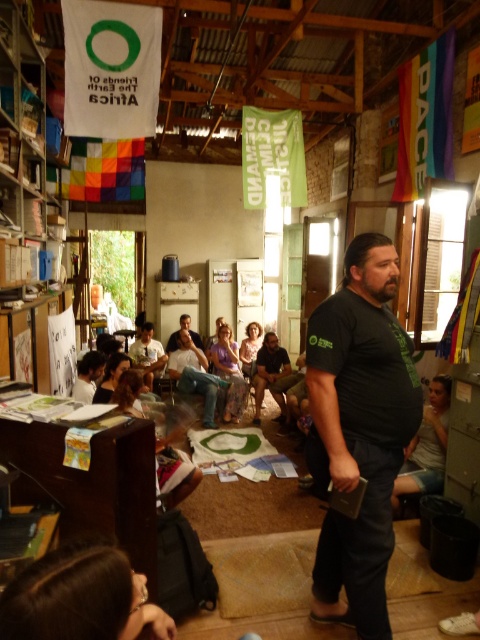
You are attending a community event and notice two people wearing similar clothing. One is wearing a black matte shirt at center and the other is wearing a matte black shirt at center. Which one is taller?

The black matte shirt at center is much taller than the matte black shirt at center.

You are a photographer positioned in the front row of the gathering. You want to take a photo of both the light brown leather jacket at center and the matte black shirt at center. Which one will appear larger in your photo?

The light brown leather jacket at center will appear larger in the photo because it is closer to the viewer than the matte black shirt at center.

You are a photographer trying to capture a clear shot of the speaker wearing the black matte shirt at center. However, there is another person in the background wearing the matte black shirt at center. Can you tell which one is closer to you based on their positions?

The black matte shirt at center is in front of the matte black shirt at center, so the one closer to you is the black matte shirt at center.